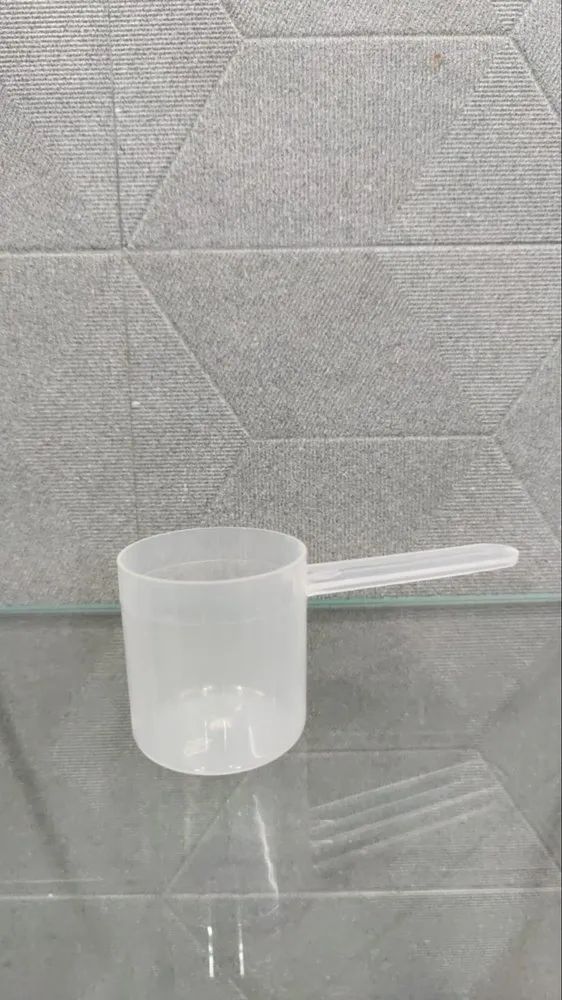
Where is `fabric backsplash`? fabric backsplash is located at coordinates (368, 357).